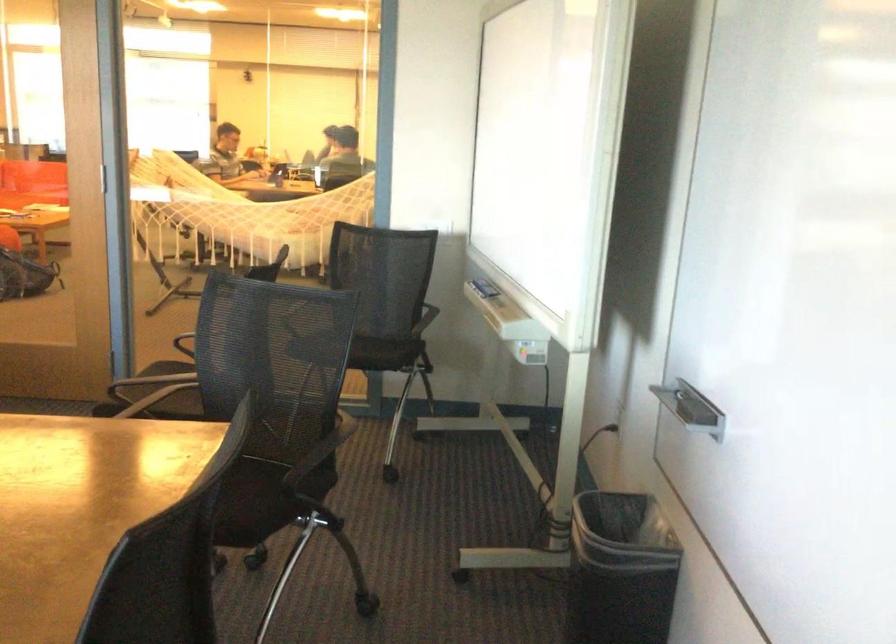
The location [621,570] corresponds to which object?

It corresponds to the black trash can in the image.